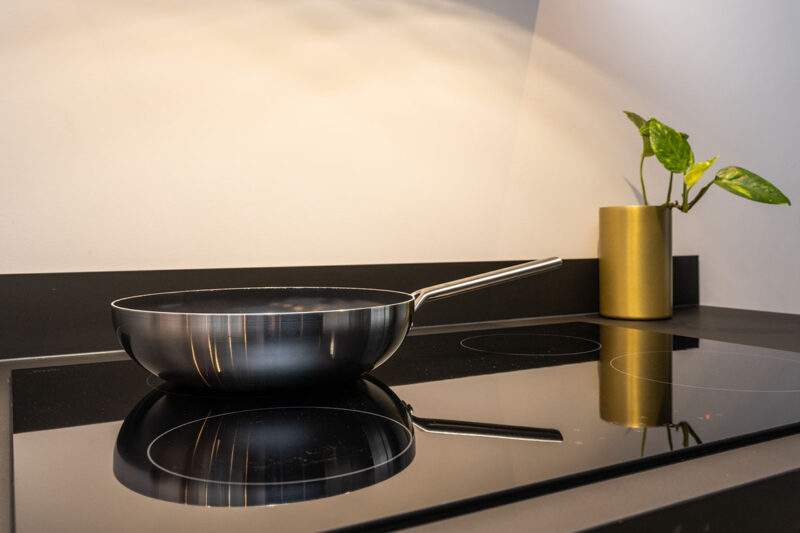
You are a GUI agent. You are given a task and a screenshot of the screen. Output one action in this format:
    pyautogui.click(x=<x>, y=<y>)
    Task: Click on the silver handle of pan
    
    Given the screenshot: What is the action you would take?
    pyautogui.click(x=486, y=277)